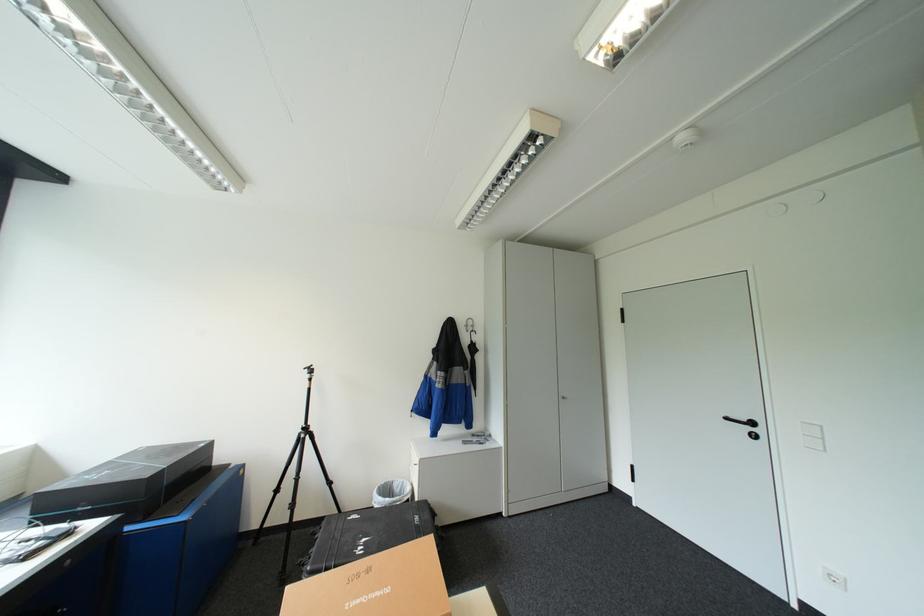
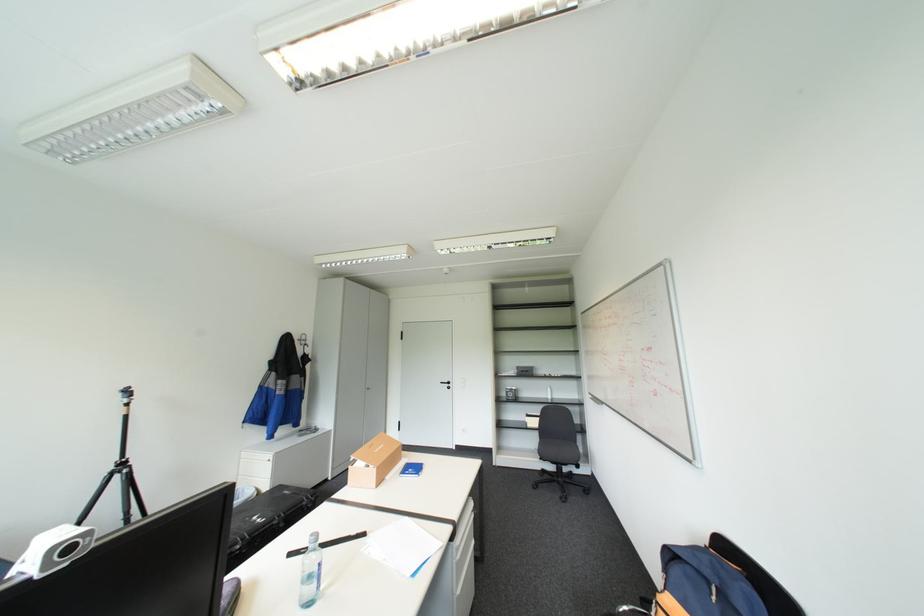
Locate, in the second image, the point that corresponds to the point at 735,416 in the first image.

(450, 381)